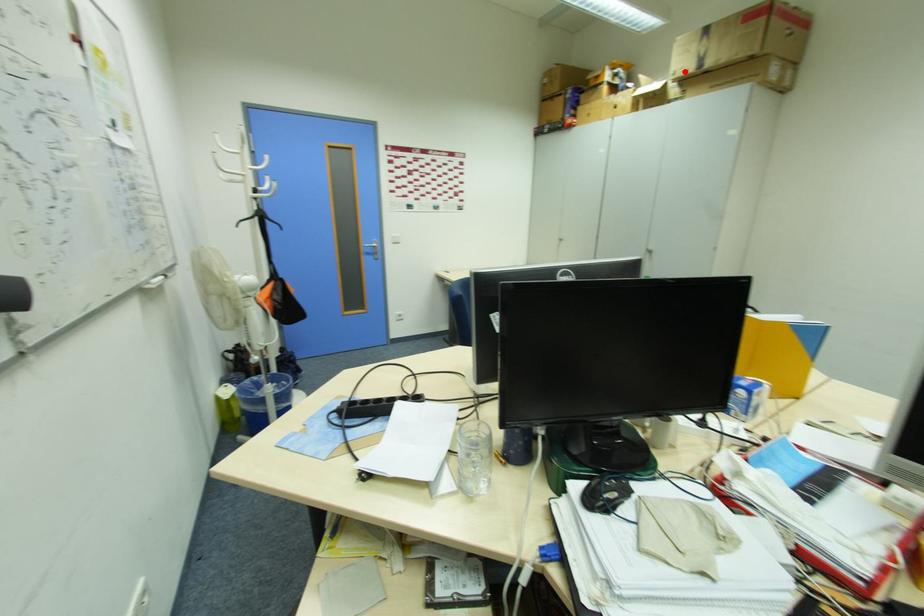
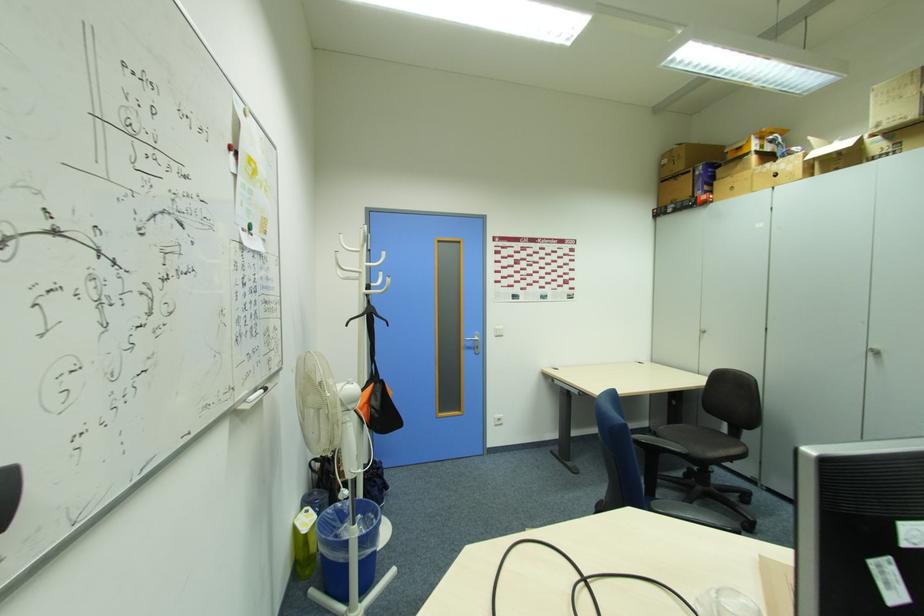
Where in the second image is the point corresponding to the highlighted location from the first image?

(889, 123)